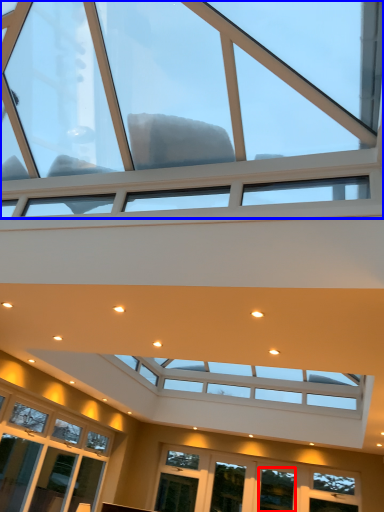
Question: Among these objects, which one is farthest to the camera, window (highlighted by a red box) or window (highlighted by a blue box)?

Choices:
 (A) window
 (B) window

Answer: (A)